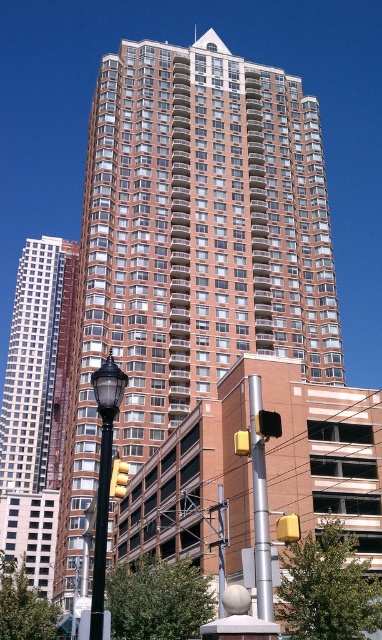
You are standing on the street in front of the residential building and want to take a photo of the shiny glass skyscraper at left. However, the black lamppost is blocking your view. Based on the coordinates provided, can you determine if the skyscraper is to the left or right of the lamppost?

The shiny glass skyscraper at left is located at point (37, 403), which means it is positioned to the right of the black lamppost since the lamppost is on the left side of the image.

You are a pedestrian standing on the sidewalk and see the shiny glass skyscraper at left and the silver metallic pole at center. Which object is closer to the ground?

The shiny glass skyscraper at left is located below the silver metallic pole at center, so it is closer to the ground.